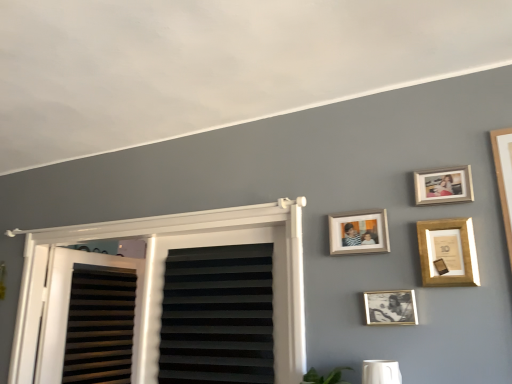
Measure the distance between black/gold photo frame at center, the first picture frame positioned from the bottom, and camera.

The depth of black/gold photo frame at center, the first picture frame positioned from the bottom, is 1.34 meters.

Describe the element at coordinates (448, 252) in the screenshot. I see `wooden picture frame at upper right, which is counted as the 2th picture frame, starting from the bottom` at that location.

You are a GUI agent. You are given a task and a screenshot of the screen. Output one action in this format:
    pyautogui.click(x=<x>, y=<y>)
    Task: Click on the wooden photo frame at upper center, the 3th picture frame in the bottom-to-top sequence
    
    Given the screenshot: What is the action you would take?
    pyautogui.click(x=359, y=232)

Locate an element on the screen. black/gold photo frame at center, the first picture frame positioned from the bottom is located at coordinates coord(390,307).

Is wooden photo frame at upper right, arranged as the first picture frame when viewed from the top, to the right of black/gold photo frame at center, the fourth picture frame in the top-to-bottom sequence, from the viewer's perspective?

Yes, wooden photo frame at upper right, arranged as the first picture frame when viewed from the top, is to the right of black/gold photo frame at center, the fourth picture frame in the top-to-bottom sequence.

Does wooden photo frame at upper right, arranged as the first picture frame when viewed from the top, touch black/gold photo frame at center, the fourth picture frame in the top-to-bottom sequence?

No, wooden photo frame at upper right, arranged as the first picture frame when viewed from the top, is not making contact with black/gold photo frame at center, the fourth picture frame in the top-to-bottom sequence.

Measure the distance between wooden photo frame at upper right, arranged as the first picture frame when viewed from the top, and black/gold photo frame at center, the fourth picture frame in the top-to-bottom sequence.

wooden photo frame at upper right, arranged as the first picture frame when viewed from the top, is 14.09 inches away from black/gold photo frame at center, the fourth picture frame in the top-to-bottom sequence.

From a real-world perspective, is wooden photo frame at upper right, arranged as the first picture frame when viewed from the top, physically above black/gold photo frame at center, the fourth picture frame in the top-to-bottom sequence?

Yes, from a real-world perspective, wooden photo frame at upper right, arranged as the first picture frame when viewed from the top, is above black/gold photo frame at center, the fourth picture frame in the top-to-bottom sequence.

Which is in front, point (374, 296) or point (376, 235)?

The point (374, 296) is closer.

Is black/gold photo frame at center, the first picture frame positioned from the bottom, situated inside wooden photo frame at upper center, the 3th picture frame in the bottom-to-top sequence, or outside?

black/gold photo frame at center, the first picture frame positioned from the bottom, cannot be found inside wooden photo frame at upper center, the 3th picture frame in the bottom-to-top sequence.

Is black/gold photo frame at center, the fourth picture frame in the top-to-bottom sequence, touching wooden photo frame at upper center, the 2th picture frame from the top?

No.

Based on the photo, is black/gold photo frame at center, the fourth picture frame in the top-to-bottom sequence, facing away from wooden photo frame at upper center, the 2th picture frame from the top?

black/gold photo frame at center, the fourth picture frame in the top-to-bottom sequence, is not turned away from wooden photo frame at upper center, the 2th picture frame from the top.

Is black/gold photo frame at center, the fourth picture frame in the top-to-bottom sequence, turned away from wooden picture frame at upper right, which is counted as the 2th picture frame, starting from the bottom?

black/gold photo frame at center, the fourth picture frame in the top-to-bottom sequence, is not turned away from wooden picture frame at upper right, which is counted as the 2th picture frame, starting from the bottom.

Is black/gold photo frame at center, the fourth picture frame in the top-to-bottom sequence, taller or shorter than wooden picture frame at upper right, which is counted as the 2th picture frame, starting from the bottom?

In the image, black/gold photo frame at center, the fourth picture frame in the top-to-bottom sequence, appears to be shorter than wooden picture frame at upper right, which is counted as the 2th picture frame, starting from the bottom.

Is black/gold photo frame at center, the first picture frame positioned from the bottom, in contact with wooden picture frame at upper right, the third picture frame from the top?

No, black/gold photo frame at center, the first picture frame positioned from the bottom, is not next to wooden picture frame at upper right, the third picture frame from the top.

How different are the orientations of black/gold photo frame at center, the fourth picture frame in the top-to-bottom sequence, and wooden picture frame at upper right, the third picture frame from the top, in degrees?

0.00401 degrees.

From a real-world perspective, is wooden picture frame at upper right, the third picture frame from the top, on wooden photo frame at upper center, the 2th picture frame from the top?

No, from a real-world perspective, wooden picture frame at upper right, the third picture frame from the top, is not on top of wooden photo frame at upper center, the 2th picture frame from the top.

Locate an element on the screen. Image resolution: width=512 pixels, height=384 pixels. picture frame that is the 1st object directly below the wooden photo frame at upper center, the 3th picture frame in the bottom-to-top sequence (from a real-world perspective) is located at coordinates (448, 252).

From the image's perspective, which one is positioned lower, wooden picture frame at upper right, the third picture frame from the top, or wooden photo frame at upper center, the 2th picture frame from the top?

wooden picture frame at upper right, the third picture frame from the top, from the image's perspective.

Are wooden picture frame at upper right, which is counted as the 2th picture frame, starting from the bottom, and wooden photo frame at upper center, the 3th picture frame in the bottom-to-top sequence, far apart?

They are positioned close to each other.

From the image's perspective, does wooden photo frame at upper right, the fourth picture frame positioned from the bottom, appear higher than wooden photo frame at upper center, the 3th picture frame in the bottom-to-top sequence?

Correct, wooden photo frame at upper right, the fourth picture frame positioned from the bottom, appears higher than wooden photo frame at upper center, the 3th picture frame in the bottom-to-top sequence, in the image.

From a real-world perspective, between wooden photo frame at upper right, arranged as the first picture frame when viewed from the top, and wooden photo frame at upper center, the 2th picture frame from the top, who is vertically lower?

wooden photo frame at upper center, the 2th picture frame from the top.

How much distance is there between wooden photo frame at upper right, arranged as the first picture frame when viewed from the top, and wooden photo frame at upper center, the 2th picture frame from the top?

8.39 inches.

Is point (454, 190) less distant than point (356, 231)?

That is True.

Can you confirm if wooden photo frame at upper center, the 2th picture frame from the top, is smaller than wooden photo frame at upper right, arranged as the first picture frame when viewed from the top?

Incorrect, wooden photo frame at upper center, the 2th picture frame from the top, is not smaller in size than wooden photo frame at upper right, arranged as the first picture frame when viewed from the top.

Considering the positions of objects wooden photo frame at upper center, the 2th picture frame from the top, and wooden photo frame at upper right, arranged as the first picture frame when viewed from the top, in the image provided, who is more to the left, wooden photo frame at upper center, the 2th picture frame from the top, or wooden photo frame at upper right, arranged as the first picture frame when viewed from the top,?

Positioned to the left is wooden photo frame at upper center, the 2th picture frame from the top.

Is wooden photo frame at upper center, the 3th picture frame in the bottom-to-top sequence, next to wooden photo frame at upper right, the fourth picture frame positioned from the bottom?

There is a gap between wooden photo frame at upper center, the 3th picture frame in the bottom-to-top sequence, and wooden photo frame at upper right, the fourth picture frame positioned from the bottom.

How far apart are wooden photo frame at upper center, the 2th picture frame from the top, and wooden photo frame at upper right, arranged as the first picture frame when viewed from the top?

wooden photo frame at upper center, the 2th picture frame from the top, and wooden photo frame at upper right, arranged as the first picture frame when viewed from the top, are 8.39 inches apart.

In the scene shown: Would you say wooden picture frame at upper right, which is counted as the 2th picture frame, starting from the bottom, is inside or outside wooden photo frame at upper right, the fourth picture frame positioned from the bottom?

wooden picture frame at upper right, which is counted as the 2th picture frame, starting from the bottom, is not enclosed by wooden photo frame at upper right, the fourth picture frame positioned from the bottom.

Considering the sizes of objects wooden picture frame at upper right, the third picture frame from the top, and wooden photo frame at upper right, arranged as the first picture frame when viewed from the top, in the image provided, who is shorter, wooden picture frame at upper right, the third picture frame from the top, or wooden photo frame at upper right, arranged as the first picture frame when viewed from the top,?

wooden photo frame at upper right, arranged as the first picture frame when viewed from the top, is shorter.

Would you consider wooden picture frame at upper right, the third picture frame from the top, to be distant from wooden photo frame at upper right, the fourth picture frame positioned from the bottom?

wooden picture frame at upper right, the third picture frame from the top, is near wooden photo frame at upper right, the fourth picture frame positioned from the bottom, not far away.

Considering the positions of point (470, 218) and point (416, 179), is point (470, 218) closer or farther from the camera than point (416, 179)?

Point (470, 218) appears to be closer to the viewer than point (416, 179).

Which picture frame is the 2nd one when counting from the right side of the black/gold photo frame at center, the first picture frame positioned from the bottom? Please provide its 2D coordinates.

[(443, 185)]

This screenshot has height=384, width=512. Find the location of `picture frame that is the 2nd one when counting downward from the wooden photo frame at upper center, the 3th picture frame in the bottom-to-top sequence (from the image's perspective)`. picture frame that is the 2nd one when counting downward from the wooden photo frame at upper center, the 3th picture frame in the bottom-to-top sequence (from the image's perspective) is located at coordinates coord(390,307).

When comparing their distances from wooden picture frame at upper right, the third picture frame from the top, does wooden photo frame at upper center, the 2th picture frame from the top, or wooden photo frame at upper right, the fourth picture frame positioned from the bottom, seem closer?

wooden photo frame at upper right, the fourth picture frame positioned from the bottom, lies closer to wooden picture frame at upper right, the third picture frame from the top, than the other object.

Considering their positions, is wooden photo frame at upper center, the 3th picture frame in the bottom-to-top sequence, positioned closer to black/gold photo frame at center, the first picture frame positioned from the bottom, than white plastic window at upper left?

wooden photo frame at upper center, the 3th picture frame in the bottom-to-top sequence, lies closer to black/gold photo frame at center, the first picture frame positioned from the bottom, than the other object.

Considering their positions, is wooden photo frame at upper right, arranged as the first picture frame when viewed from the top, positioned further to black/gold photo frame at center, the fourth picture frame in the top-to-bottom sequence, than wooden photo frame at upper center, the 2th picture frame from the top?

Among the two, wooden photo frame at upper right, arranged as the first picture frame when viewed from the top, is located further to black/gold photo frame at center, the fourth picture frame in the top-to-bottom sequence.

Estimate the real-world distances between objects in this image. Which object is closer to black/gold photo frame at center, the fourth picture frame in the top-to-bottom sequence, wooden picture frame at upper right, which is counted as the 2th picture frame, starting from the bottom, or white plastic window at upper left?

wooden picture frame at upper right, which is counted as the 2th picture frame, starting from the bottom, is closer to black/gold photo frame at center, the fourth picture frame in the top-to-bottom sequence.

Estimate the real-world distances between objects in this image. Which object is further from wooden photo frame at upper center, the 3th picture frame in the bottom-to-top sequence, wooden photo frame at upper right, the fourth picture frame positioned from the bottom, or white plastic window at upper left?

Based on the image, white plastic window at upper left appears to be further to wooden photo frame at upper center, the 3th picture frame in the bottom-to-top sequence.

Based on their spatial positions, is black/gold photo frame at center, the fourth picture frame in the top-to-bottom sequence, or wooden photo frame at upper right, the fourth picture frame positioned from the bottom, closer to white plastic window at upper left?

Based on the image, black/gold photo frame at center, the fourth picture frame in the top-to-bottom sequence, appears to be nearer to white plastic window at upper left.

Which object lies nearer to the anchor point wooden picture frame at upper right, the third picture frame from the top, black/gold photo frame at center, the first picture frame positioned from the bottom, or wooden photo frame at upper center, the 2th picture frame from the top?

Based on the image, black/gold photo frame at center, the first picture frame positioned from the bottom, appears to be nearer to wooden picture frame at upper right, the third picture frame from the top.

Which object lies further to the anchor point black/gold photo frame at center, the fourth picture frame in the top-to-bottom sequence, wooden photo frame at upper center, the 2th picture frame from the top, or wooden picture frame at upper right, the third picture frame from the top?

wooden photo frame at upper center, the 2th picture frame from the top, is positioned further to the anchor black/gold photo frame at center, the fourth picture frame in the top-to-bottom sequence.

Find the location of a particular element. The height and width of the screenshot is (384, 512). picture frame situated between white plastic window at upper left and black/gold photo frame at center, the first picture frame positioned from the bottom, from left to right is located at coordinates (359, 232).

The image size is (512, 384). Find the location of `picture frame between wooden photo frame at upper center, the 2th picture frame from the top, and black/gold photo frame at center, the first picture frame positioned from the bottom, in the up-down direction`. picture frame between wooden photo frame at upper center, the 2th picture frame from the top, and black/gold photo frame at center, the first picture frame positioned from the bottom, in the up-down direction is located at coordinates (448, 252).